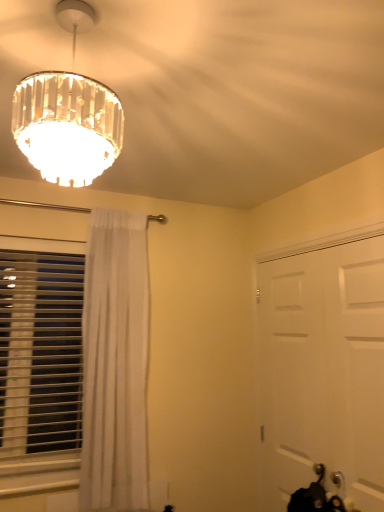
What do you see at coordinates (322, 370) in the screenshot? I see `white matte door at right` at bounding box center [322, 370].

In order to face white plastic blinds at left, should I rotate leftwards or rightwards?

It's best to rotate left around 19.690 degrees.

Locate an element on the screen. white matte door at right is located at coordinates (322, 370).

Is clear crystal chandelier at upper left looking in the opposite direction of white plastic blinds at left?

No, clear crystal chandelier at upper left's orientation is not away from white plastic blinds at left.

In terms of height, does clear crystal chandelier at upper left look taller or shorter compared to white plastic blinds at left?

Considering their sizes, clear crystal chandelier at upper left has less height than white plastic blinds at left.

Where is `fan located on the right of white plastic blinds at left`? This screenshot has height=512, width=384. fan located on the right of white plastic blinds at left is located at coordinates (237, 93).

How different are the orientations of clear crystal chandelier at upper left and white plastic blinds at left in degrees?

There is a 90.7-degree angle between the facing directions of clear crystal chandelier at upper left and white plastic blinds at left.

From the image's perspective, is clear crystal chandelier at upper left located above or below white matte door at right?

clear crystal chandelier at upper left is above white matte door at right.

Is clear crystal chandelier at upper left touching white matte door at right?

clear crystal chandelier at upper left and white matte door at right are not in contact.

From a real-world perspective, is clear crystal chandelier at upper left positioned above or below white matte door at right?

From a real-world perspective, clear crystal chandelier at upper left is physically above white matte door at right.

Locate an element on the screen. The width and height of the screenshot is (384, 512). window behind the white sheer curtain at left is located at coordinates (40, 353).

Considering the sizes of white sheer curtain at left and white plastic blinds at left in the image, is white sheer curtain at left wider or thinner than white plastic blinds at left?

Clearly, white sheer curtain at left has more width compared to white plastic blinds at left.

Considering the relative positions of white sheer curtain at left and white plastic blinds at left in the image provided, is white sheer curtain at left to the right of white plastic blinds at left from the viewer's perspective?

Indeed, white sheer curtain at left is positioned on the right side of white plastic blinds at left.

Which is behind, point (134, 434) or point (0, 253)?

The point (0, 253) is more distant.

Is point (307, 346) closer or farther from the camera than point (88, 264)?

Point (307, 346) is closer to the camera than point (88, 264).

Is white sheer curtain at left a part of white matte door at right?

No, white matte door at right does not contain white sheer curtain at left.

From a real-world perspective, is white matte door at right located beneath white sheer curtain at left?

Yes, from a real-world perspective, white matte door at right is beneath white sheer curtain at left.

Which object is positioned more to the left, white matte door at right or white sheer curtain at left?

white sheer curtain at left.

From the picture: Can you tell me how much white plastic blinds at left and clear crystal chandelier at upper left differ in facing direction?

There is a 90.7-degree angle between the facing directions of white plastic blinds at left and clear crystal chandelier at upper left.

Considering their positions, is white plastic blinds at left located in front of or behind clear crystal chandelier at upper left?

white plastic blinds at left is behind clear crystal chandelier at upper left.

Could you tell me if white plastic blinds at left is turned towards clear crystal chandelier at upper left?

No, white plastic blinds at left is not turned towards clear crystal chandelier at upper left.

The width and height of the screenshot is (384, 512). Identify the location of window directly beneath the clear crystal chandelier at upper left (from a real-world perspective). (40, 353).

Is white plastic blinds at left oriented away from white matte door at right?

No, white plastic blinds at left is not facing the opposite direction of white matte door at right.

Considering the sizes of white plastic blinds at left and white matte door at right in the image, is white plastic blinds at left taller or shorter than white matte door at right?

In the image, white plastic blinds at left appears to be shorter than white matte door at right.

I want to click on window located above the white matte door at right (from the image's perspective), so click(40, 353).

Visually, is white plastic blinds at left positioned to the left or to the right of white matte door at right?

white plastic blinds at left is positioned on white matte door at right's left side.

Considering the sizes of objects white matte door at right and white plastic blinds at left in the image provided, who is thinner, white matte door at right or white plastic blinds at left?

Thinner between the two is white matte door at right.

From a real-world perspective, which is physically below, white matte door at right or white plastic blinds at left?

white matte door at right.

Can you tell me how much white matte door at right and white plastic blinds at left differ in facing direction?

They differ by 89 degrees in their facing directions.

The height and width of the screenshot is (512, 384). What are the coordinates of `window below the clear crystal chandelier at upper left (from the image's perspective)` in the screenshot? It's located at (40, 353).

Where is `fan above the white matte door at right (from a real-world perspective)`? The width and height of the screenshot is (384, 512). fan above the white matte door at right (from a real-world perspective) is located at coordinates (237, 93).

From the image, which object appears to be nearer to clear crystal chandelier at upper left, white plastic blinds at left or white matte door at right?

Among the two, white matte door at right is located nearer to clear crystal chandelier at upper left.

Estimate the real-world distances between objects in this image. Which object is further from white plastic blinds at left, white matte door at right or white sheer curtain at left?

white matte door at right.

Looking at the image, which one is located closer to white matte door at right, clear crystal chandelier at upper left or white plastic blinds at left?

Based on the image, clear crystal chandelier at upper left appears to be nearer to white matte door at right.

From the image, which object appears to be nearer to white sheer curtain at left, white matte door at right or clear crystal chandelier at upper left?

Based on the image, white matte door at right appears to be nearer to white sheer curtain at left.

Based on their spatial positions, is white plastic blinds at left or clear crystal chandelier at upper left closer to white matte door at right?

clear crystal chandelier at upper left lies closer to white matte door at right than the other object.

Estimate the real-world distances between objects in this image. Which object is further from white sheer curtain at left, clear crystal chandelier at upper left or white matte door at right?

Based on the image, clear crystal chandelier at upper left appears to be further to white sheer curtain at left.

Which object lies nearer to the anchor point white matte door at right, clear crystal chandelier at upper left or white sheer curtain at left?

The object closer to white matte door at right is white sheer curtain at left.

When comparing their distances from white sheer curtain at left, does clear crystal chandelier at upper left or white plastic blinds at left seem closer?

The object closer to white sheer curtain at left is white plastic blinds at left.

You are a GUI agent. You are given a task and a screenshot of the screen. Output one action in this format:
    pyautogui.click(x=<x>, y=<y>)
    Task: Click on the curtain that lies between clear crystal chandelier at upper left and white matte door at right from top to bottom
    
    Given the screenshot: What is the action you would take?
    pyautogui.click(x=115, y=362)

Where is `curtain between white plastic blinds at left and white matte door at right from left to right`? The height and width of the screenshot is (512, 384). curtain between white plastic blinds at left and white matte door at right from left to right is located at coordinates (115, 362).

This screenshot has width=384, height=512. In order to click on fan between white plastic blinds at left and white matte door at right from left to right in this screenshot , I will do `click(237, 93)`.

Identify the location of curtain located between clear crystal chandelier at upper left and white plastic blinds at left in the depth direction. (115, 362).